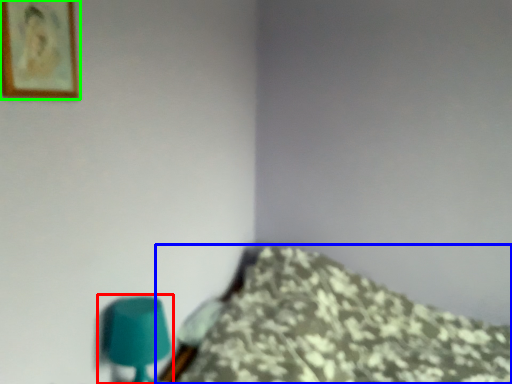
Question: Which is nearer to the table lamp (highlighted by a red box)? furniture (highlighted by a blue box) or picture frame (highlighted by a green box).

Choices:
 (A) furniture
 (B) picture frame

Answer: (B)